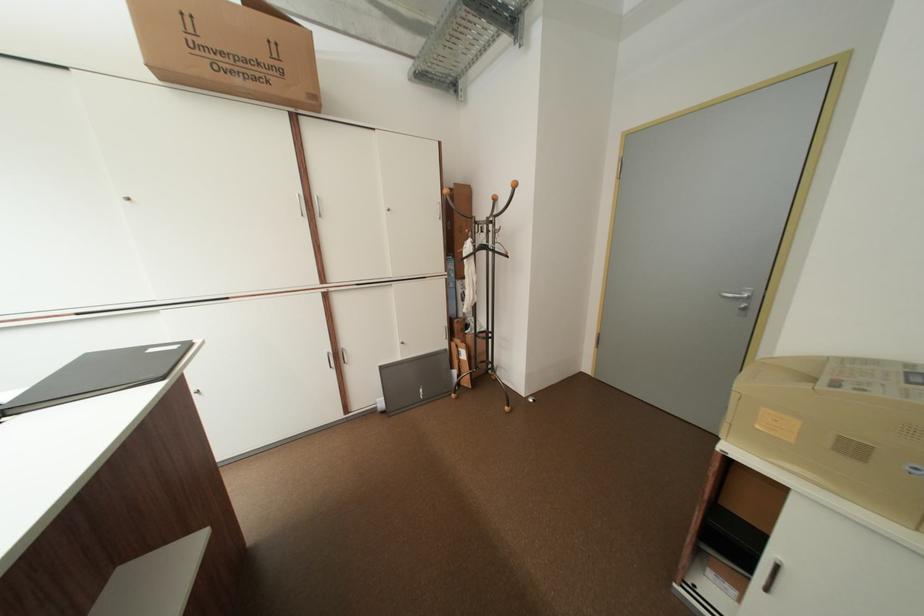
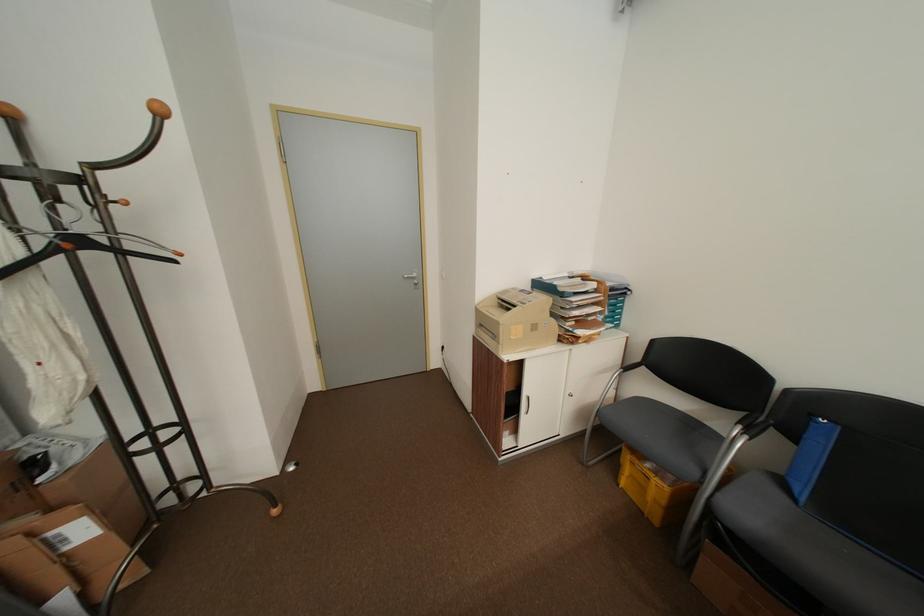
In the second image, find the point that corresponds to pixel 469 350 in the first image.

(63, 533)